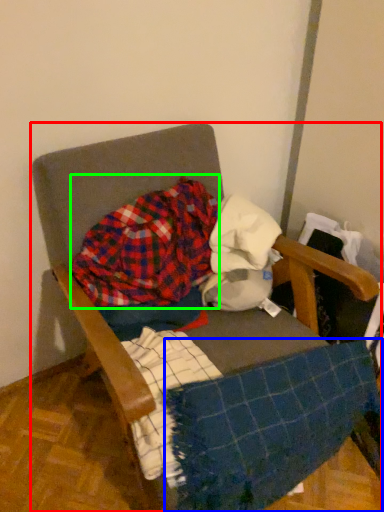
Question: Which object is the farthest from chair (highlighted by a red box)? Choose among these: blanket (highlighted by a blue box) or flannel (highlighted by a green box).

Choices:
 (A) blanket
 (B) flannel

Answer: (A)